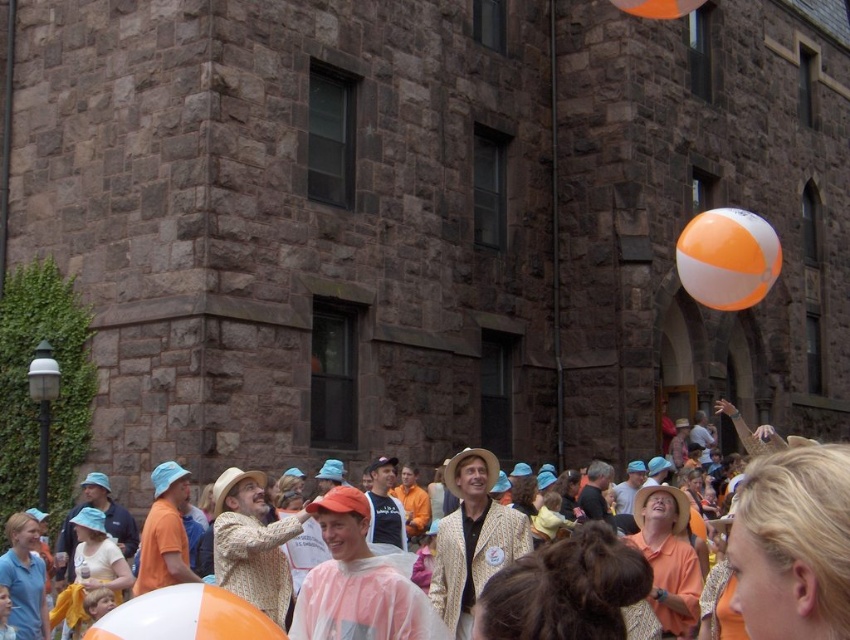
Can you confirm if orange and white striped balloon at lower left is wider than orange/beach ball at upper right?

Indeed, orange and white striped balloon at lower left has a greater width compared to orange/beach ball at upper right.

Does point (197, 634) come in front of point (630, 3)?

Yes.

Is point (148, 609) farther from viewer compared to point (630, 4)?

That is False.

Locate an element on the screen. orange and white striped balloon at lower left is located at coordinates (185, 616).

Is orange and white beach ball at lower left to the left of orange and white striped balloon at lower left from the viewer's perspective?

No, orange and white beach ball at lower left is not to the left of orange and white striped balloon at lower left.

Who is positioned more to the left, orange and white beach ball at lower left or orange and white striped balloon at lower left?

From the viewer's perspective, orange and white striped balloon at lower left appears more on the left side.

The width and height of the screenshot is (850, 640). What do you see at coordinates (795, 536) in the screenshot?
I see `orange and white beach ball at lower left` at bounding box center [795, 536].

This screenshot has width=850, height=640. I want to click on orange and white beach ball at lower left, so click(x=795, y=536).

Is orange and white beach ball at upper right below orange and white striped balloon at lower left?

No, orange and white beach ball at upper right is not below orange and white striped balloon at lower left.

Which is below, orange and white beach ball at upper right or orange and white striped balloon at lower left?

Positioned lower is orange and white striped balloon at lower left.

Between point (723, 236) and point (225, 632), which one is positioned behind?

Positioned behind is point (723, 236).

This screenshot has height=640, width=850. I want to click on orange and white beach ball at upper right, so click(x=727, y=259).